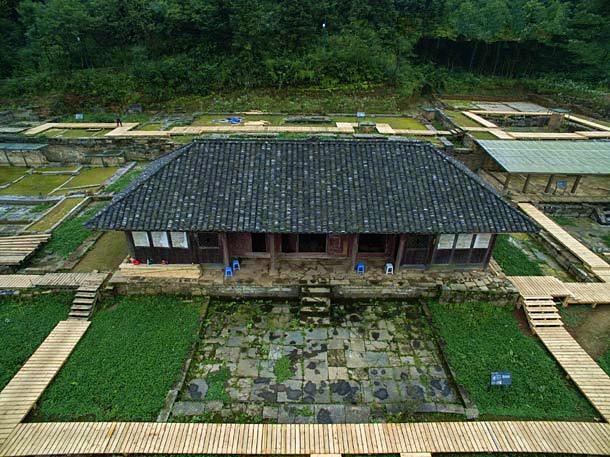
You are a GUI agent. You are given a task and a screenshot of the screen. Output one action in this format:
    pyautogui.click(x=<x>, y=<y>)
    Task: Click on the window
    Image resolution: width=610 pixels, height=457 pixels.
    Given the screenshot: What is the action you would take?
    pyautogui.click(x=178, y=238)